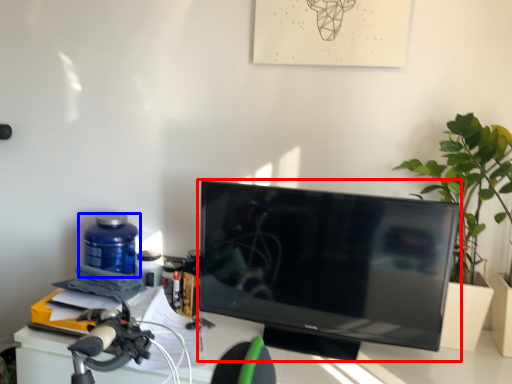
Question: Among these objects, which one is farthest to the camera, television (highlighted by a red box) or bottle (highlighted by a blue box)?

Choices:
 (A) television
 (B) bottle

Answer: (B)